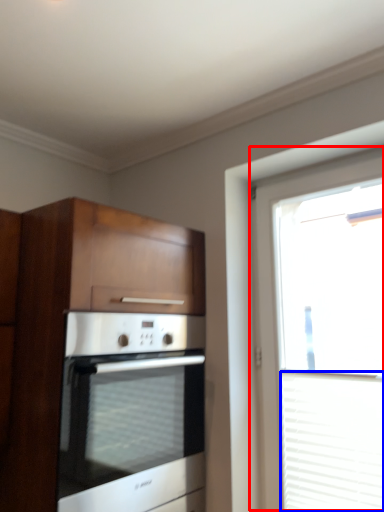
Question: Which point is further to the camera, window (highlighted by a red box) or blind (highlighted by a blue box)?

Choices:
 (A) window
 (B) blind

Answer: (B)